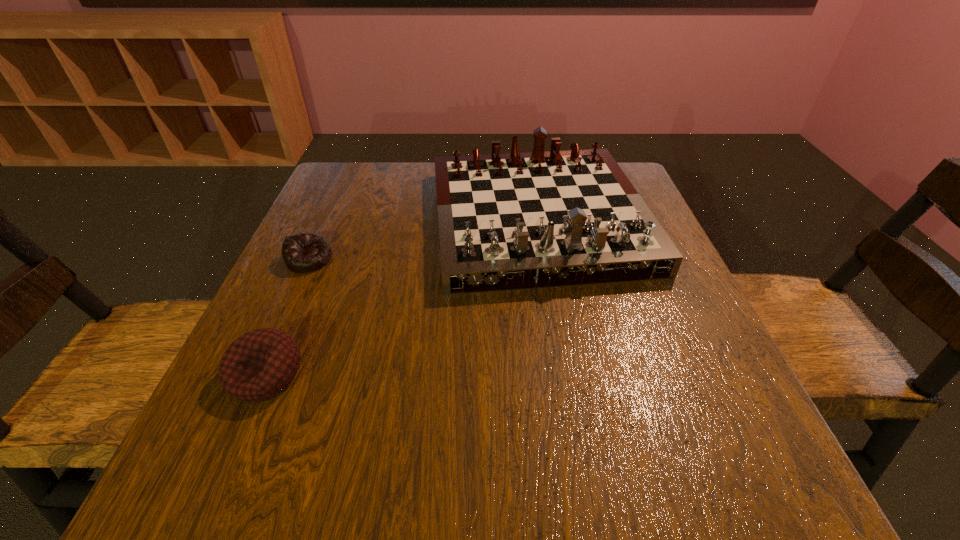
Find the location of a particular element. Image resolution: width=960 pixels, height=540 pixels. free space between the shortest object and the taller beanbag is located at coordinates (288, 316).

This screenshot has width=960, height=540. Identify the location of free space between the nearest object and the gameboard. (402, 297).

Where is `free point between the rightmost object and the shorter beanbag`? free point between the rightmost object and the shorter beanbag is located at coordinates [x=423, y=239].

This screenshot has height=540, width=960. In order to click on vacant area between the second tallest object and the rightmost object in this screenshot , I will do point(402,297).

I want to click on free space between the second shortest object and the shortest object, so click(x=288, y=316).

You are a GUI agent. You are given a task and a screenshot of the screen. Output one action in this format:
    pyautogui.click(x=<x>, y=<y>)
    Task: Click on the vacant area that lies between the farther beanbag and the tallest object
    
    Given the screenshot: What is the action you would take?
    pyautogui.click(x=423, y=239)

Identify the location of empty space between the nearer beanbag and the shortest object. This screenshot has height=540, width=960. (288, 316).

Where is `free space that is in between the farther beanbag and the rightmost object`? The width and height of the screenshot is (960, 540). free space that is in between the farther beanbag and the rightmost object is located at coordinates (423, 239).

Identify the location of vacant space in between the second tallest object and the rightmost object. (402, 297).

In order to click on the closest object to the nearest object in this screenshot , I will do `click(303, 252)`.